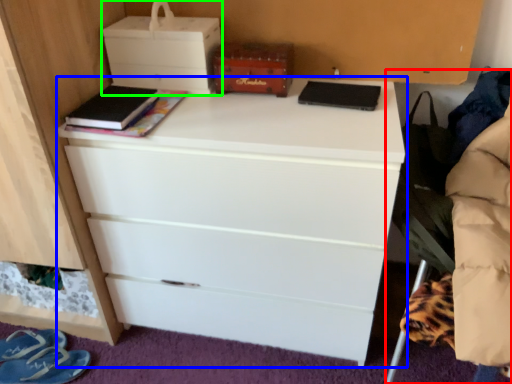
Question: Estimate the real-world distances between objects in this image. Which object is closer to swivel chair (highlighted by a red box), chest of drawers (highlighted by a blue box) or storage box (highlighted by a green box)?

Choices:
 (A) chest of drawers
 (B) storage box

Answer: (A)